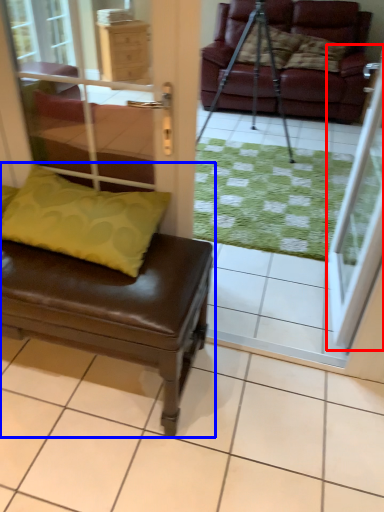
Question: Among these objects, which one is farthest to the camera, screen door (highlighted by a red box) or studio couch (highlighted by a blue box)?

Choices:
 (A) screen door
 (B) studio couch

Answer: (A)